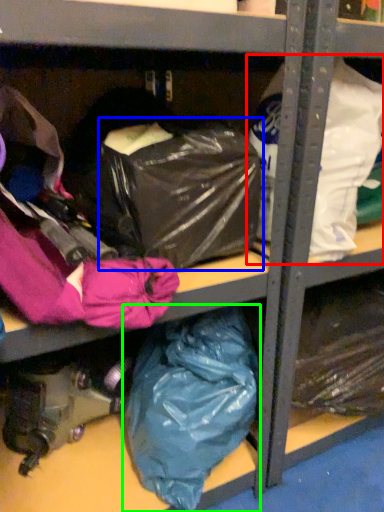
Question: Which is nearer to the plastic bag (highlighted by a red box)? bag (highlighted by a blue box) or plastic bag (highlighted by a green box).

Choices:
 (A) bag
 (B) plastic bag

Answer: (A)